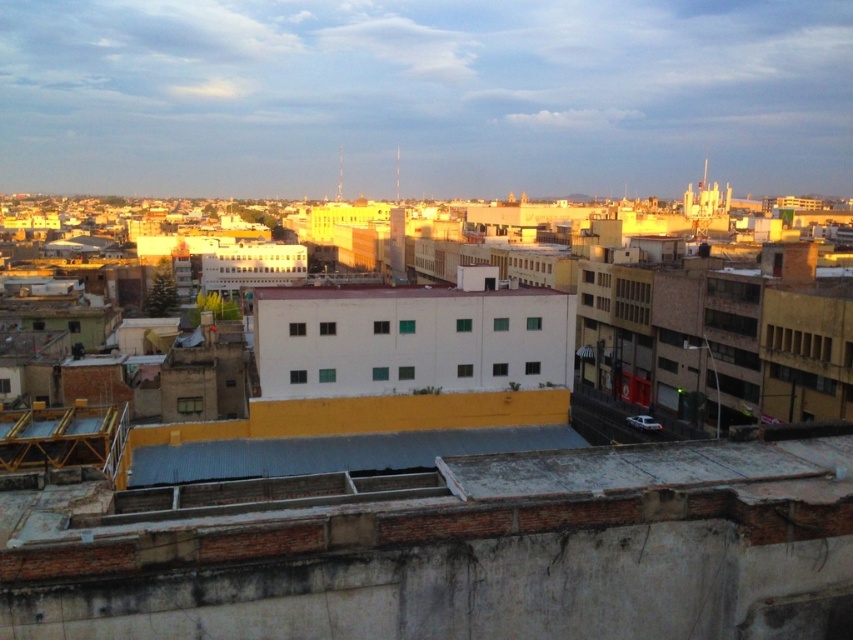
Is gray corrugated metal roof at lower right smaller than gray corrugated metal roof at center?

No.

Between gray corrugated metal roof at lower right and gray corrugated metal roof at center, which one appears on the right side from the viewer's perspective?

From the viewer's perspective, gray corrugated metal roof at lower right appears more on the right side.

You are a GUI agent. You are given a task and a screenshot of the screen. Output one action in this format:
    pyautogui.click(x=<x>, y=<y>)
    Task: Click on the gray corrugated metal roof at lower right
    
    Given the screenshot: What is the action you would take?
    pyautogui.click(x=654, y=465)